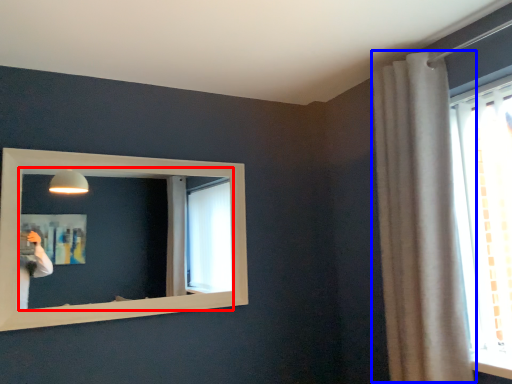
Question: Which point is further to the camera, mirror (highlighted by a red box) or curtain (highlighted by a blue box)?

Choices:
 (A) mirror
 (B) curtain

Answer: (A)